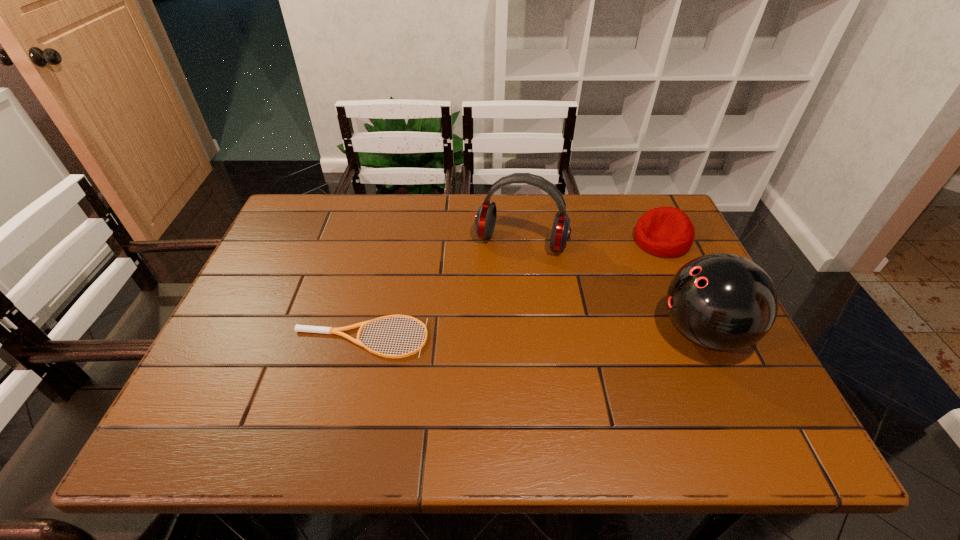
You are a GUI agent. You are given a task and a screenshot of the screen. Output one action in this format:
    pyautogui.click(x=<x>, y=<y>)
    Task: Click on the vacant spot on the desktop that is between the tennis racket and the bowling ball and is positioned on the ear cups of the earphone
    
    Given the screenshot: What is the action you would take?
    pyautogui.click(x=492, y=336)

Locate an element on the screen. free spot on the desktop that is between the leftmost object and the bowling ball and is positioned on the seat area of the beanbag is located at coordinates (526, 335).